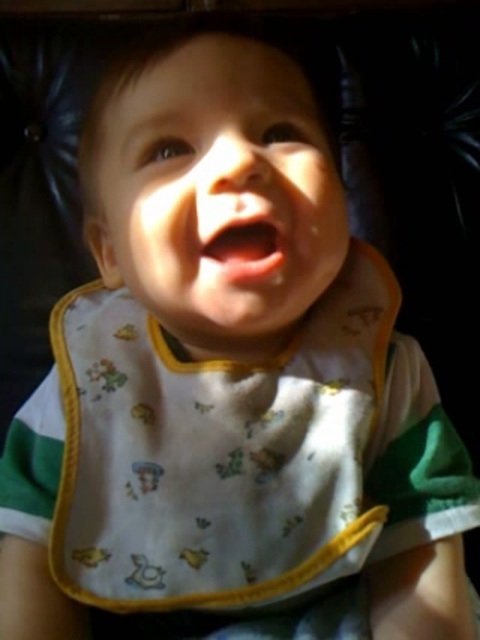
Question: Is white/yellow fabric bib at center smaller than smooth skin face at center?

Choices:
 (A) yes
 (B) no

Answer: (B)

Question: Which point is closer to the camera taking this photo?

Choices:
 (A) (264, 266)
 (B) (316, 221)

Answer: (A)

Question: Is white/yellow fabric bib at center bigger than pink glossy lips at center?

Choices:
 (A) no
 (B) yes

Answer: (B)

Question: Which object is farther from the camera taking this photo?

Choices:
 (A) smooth skin face at center
 (B) white/yellow fabric bib at center
 (C) pink glossy lips at center

Answer: (B)

Question: Which point is farther from the camera taking this photo?

Choices:
 (A) (247, 444)
 (B) (278, 250)
 (C) (107, 195)

Answer: (A)

Question: Can you confirm if white/yellow fabric bib at center is positioned to the left of pink glossy lips at center?

Choices:
 (A) no
 (B) yes

Answer: (B)